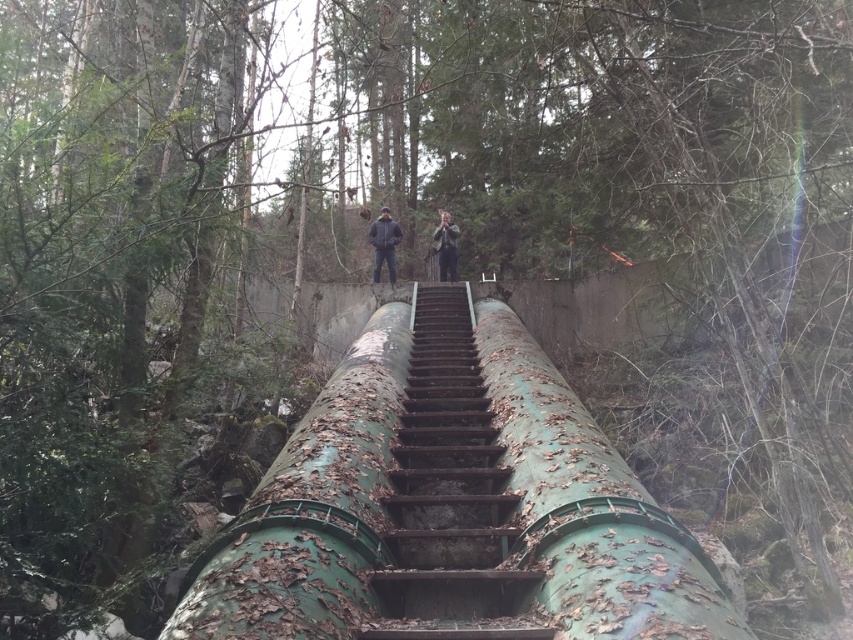
From the picture: How distant is rusty metal stairs at center from dark gray jacket at center?

rusty metal stairs at center and dark gray jacket at center are 5.58 meters apart from each other.

Between rusty metal stairs at center and dark gray jacket at center, which one is positioned higher?

dark gray jacket at center is above.

The height and width of the screenshot is (640, 853). Describe the element at coordinates (450, 496) in the screenshot. I see `rusty metal stairs at center` at that location.

Image resolution: width=853 pixels, height=640 pixels. What are the coordinates of `rusty metal stairs at center` in the screenshot? It's located at (450, 496).

Does green rusted water pipe at center have a greater width compared to rusty metal stairs at center?

Indeed, green rusted water pipe at center has a greater width compared to rusty metal stairs at center.

Can you confirm if green rusted water pipe at center is taller than rusty metal stairs at center?

Yes, green rusted water pipe at center is taller than rusty metal stairs at center.

Does point (294, 506) come closer to viewer compared to point (450, 326)?

Yes.

This screenshot has height=640, width=853. I want to click on green rusted water pipe at center, so click(451, 506).

Which of these two, green rusted water pipe at center or green mossy pipe at center, stands taller?

green mossy pipe at center is taller.

Is green rusted water pipe at center to the right of green mossy pipe at center from the viewer's perspective?

No, green rusted water pipe at center is not to the right of green mossy pipe at center.

You are a GUI agent. You are given a task and a screenshot of the screen. Output one action in this format:
    pyautogui.click(x=<x>, y=<y>)
    Task: Click on the green rusted water pipe at center
    This screenshot has width=853, height=640.
    Given the screenshot: What is the action you would take?
    pyautogui.click(x=451, y=506)